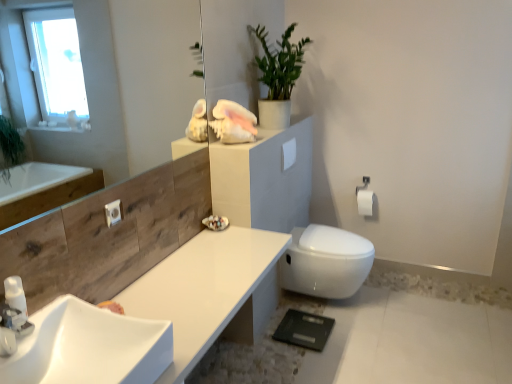
Locate an element on the screen. The width and height of the screenshot is (512, 384). vacant location below white glossy bidet at lower right (from a real-world perspective) is located at coordinates (328, 304).